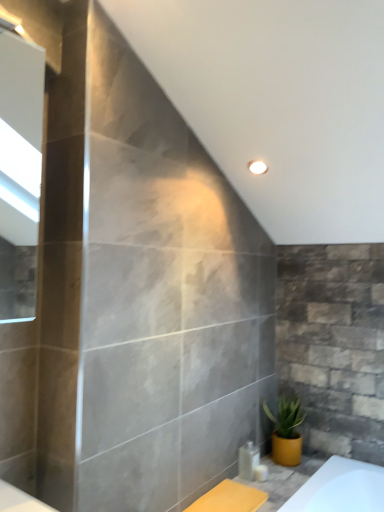
What is the approximate height of white glossy soap dispenser at lower center, which is the second toiletry in left-to-right order?

white glossy soap dispenser at lower center, which is the second toiletry in left-to-right order, is 1.95 inches in height.

Find the location of a particular element. This screenshot has width=384, height=512. white glossy soap dispenser at lower center, the 1th toiletry in the right-to-left sequence is located at coordinates (261, 473).

Is clear plastic bottle at lower right, which is counted as the second toiletry, starting from the right, far away from white glossy soap dispenser at lower center, the 1th toiletry in the right-to-left sequence?

clear plastic bottle at lower right, which is counted as the second toiletry, starting from the right, is near white glossy soap dispenser at lower center, the 1th toiletry in the right-to-left sequence, not far away.

Is white glossy soap dispenser at lower center, the 1th toiletry in the right-to-left sequence, completely or partially inside clear plastic bottle at lower right, the 1th toiletry from the left?

No.

In the scene shown: Is clear plastic bottle at lower right, the 1th toiletry from the left, behind white glossy soap dispenser at lower center, the 1th toiletry in the right-to-left sequence?

Yes, clear plastic bottle at lower right, the 1th toiletry from the left, is further from the viewer.

From a real-world perspective, which is physically below, clear plastic bottle at lower right, which is counted as the second toiletry, starting from the right, or white glossy soap dispenser at lower center, which is the second toiletry in left-to-right order?

white glossy soap dispenser at lower center, which is the second toiletry in left-to-right order, is physically lower.

Can you confirm if clear plastic bottle at lower right, the 1th toiletry from the left, is bigger than yellow matte pot at lower right?

Incorrect, clear plastic bottle at lower right, the 1th toiletry from the left, is not larger than yellow matte pot at lower right.

Based on the photo, is clear plastic bottle at lower right, the 1th toiletry from the left, not close to yellow matte pot at lower right?

That's not correct — clear plastic bottle at lower right, the 1th toiletry from the left, is a little close to yellow matte pot at lower right.

Is clear plastic bottle at lower right, the 1th toiletry from the left, aimed at yellow matte pot at lower right?

No, clear plastic bottle at lower right, the 1th toiletry from the left, is not turned towards yellow matte pot at lower right.

There is a white glossy soap dispenser at lower center, the 1th toiletry in the right-to-left sequence. Where is `houseplant above it (from a real-world perspective)`? The height and width of the screenshot is (512, 384). houseplant above it (from a real-world perspective) is located at coordinates (286, 431).

Can you confirm if yellow matte pot at lower right is bigger than white glossy soap dispenser at lower center, which is the second toiletry in left-to-right order?

Yes.

How different are the orientations of white glossy soap dispenser at lower center, which is the second toiletry in left-to-right order, and clear plastic bottle at lower right, which is counted as the second toiletry, starting from the right, in degrees?

The angle between the facing direction of white glossy soap dispenser at lower center, which is the second toiletry in left-to-right order, and the facing direction of clear plastic bottle at lower right, which is counted as the second toiletry, starting from the right, is 1.28 degrees.

In the scene shown: Which of these two, white glossy soap dispenser at lower center, the 1th toiletry in the right-to-left sequence, or clear plastic bottle at lower right, which is counted as the second toiletry, starting from the right, is thinner?

Thinner between the two is white glossy soap dispenser at lower center, the 1th toiletry in the right-to-left sequence.

Between white glossy soap dispenser at lower center, which is the second toiletry in left-to-right order, and clear plastic bottle at lower right, which is counted as the second toiletry, starting from the right, which one has smaller size?

white glossy soap dispenser at lower center, which is the second toiletry in left-to-right order.

Is white glossy soap dispenser at lower center, the 1th toiletry in the right-to-left sequence, oriented away from clear plastic bottle at lower right, the 1th toiletry from the left?

That's right, white glossy soap dispenser at lower center, the 1th toiletry in the right-to-left sequence, is facing away from clear plastic bottle at lower right, the 1th toiletry from the left.

From the image's perspective, is white glossy soap dispenser at lower center, which is the second toiletry in left-to-right order, under yellow matte pot at lower right?

Indeed, from the image's perspective, white glossy soap dispenser at lower center, which is the second toiletry in left-to-right order, is shown beneath yellow matte pot at lower right.

Is white glossy soap dispenser at lower center, the 1th toiletry in the right-to-left sequence, bigger or smaller than yellow matte pot at lower right?

Clearly, white glossy soap dispenser at lower center, the 1th toiletry in the right-to-left sequence, is smaller in size than yellow matte pot at lower right.

Is white glossy soap dispenser at lower center, the 1th toiletry in the right-to-left sequence, looking in the opposite direction of yellow matte pot at lower right?

No, white glossy soap dispenser at lower center, the 1th toiletry in the right-to-left sequence, is not facing away from yellow matte pot at lower right.

Which of these two, white glossy soap dispenser at lower center, the 1th toiletry in the right-to-left sequence, or yellow matte pot at lower right, is wider?

Answer: Wider between the two is yellow matte pot at lower right.

Which is in front, point (279, 412) or point (247, 462)?

The point (247, 462) is closer to the camera.

Where is `houseplant located above the clear plastic bottle at lower right, the 1th toiletry from the left (from a real-world perspective)`? The height and width of the screenshot is (512, 384). houseplant located above the clear plastic bottle at lower right, the 1th toiletry from the left (from a real-world perspective) is located at coordinates coord(286,431).

In terms of width, does yellow matte pot at lower right look wider or thinner when compared to clear plastic bottle at lower right, the 1th toiletry from the left?

yellow matte pot at lower right is wider than clear plastic bottle at lower right, the 1th toiletry from the left.

Does yellow matte pot at lower right have a smaller size compared to clear plastic bottle at lower right, which is counted as the second toiletry, starting from the right?

Incorrect, yellow matte pot at lower right is not smaller in size than clear plastic bottle at lower right, which is counted as the second toiletry, starting from the right.

The width and height of the screenshot is (384, 512). What are the coordinates of `toiletry that is above the white glossy soap dispenser at lower center, which is the second toiletry in left-to-right order (from a real-world perspective)` in the screenshot? It's located at (248, 460).

This screenshot has height=512, width=384. I want to click on houseplant that is on the right side of clear plastic bottle at lower right, the 1th toiletry from the left, so click(x=286, y=431).

Estimate the real-world distances between objects in this image. Which object is closer to yellow matte pot at lower right, clear plastic bottle at lower right, which is counted as the second toiletry, starting from the right, or white glossy soap dispenser at lower center, the 1th toiletry in the right-to-left sequence?

clear plastic bottle at lower right, which is counted as the second toiletry, starting from the right.

Which object lies nearer to the anchor point yellow matte pot at lower right, white glossy soap dispenser at lower center, the 1th toiletry in the right-to-left sequence, or clear plastic bottle at lower right, the 1th toiletry from the left?

Based on the image, clear plastic bottle at lower right, the 1th toiletry from the left, appears to be nearer to yellow matte pot at lower right.

Considering their positions, is white glossy soap dispenser at lower center, the 1th toiletry in the right-to-left sequence, positioned closer to clear plastic bottle at lower right, which is counted as the second toiletry, starting from the right, than yellow matte pot at lower right?

white glossy soap dispenser at lower center, the 1th toiletry in the right-to-left sequence, is positioned closer to the anchor clear plastic bottle at lower right, which is counted as the second toiletry, starting from the right.

Considering their positions, is clear plastic bottle at lower right, which is counted as the second toiletry, starting from the right, positioned further to white glossy soap dispenser at lower center, the 1th toiletry in the right-to-left sequence, than yellow matte pot at lower right?

Based on the image, yellow matte pot at lower right appears to be further to white glossy soap dispenser at lower center, the 1th toiletry in the right-to-left sequence.

Consider the image. Looking at the image, which one is located closer to white glossy soap dispenser at lower center, the 1th toiletry in the right-to-left sequence, yellow matte pot at lower right or clear plastic bottle at lower right, which is counted as the second toiletry, starting from the right?

clear plastic bottle at lower right, which is counted as the second toiletry, starting from the right, lies closer to white glossy soap dispenser at lower center, the 1th toiletry in the right-to-left sequence, than the other object.

When comparing their distances from clear plastic bottle at lower right, which is counted as the second toiletry, starting from the right, does yellow matte pot at lower right or white glossy soap dispenser at lower center, the 1th toiletry in the right-to-left sequence, seem further?

yellow matte pot at lower right lies further to clear plastic bottle at lower right, which is counted as the second toiletry, starting from the right, than the other object.

Where is `toiletry located between clear plastic bottle at lower right, which is counted as the second toiletry, starting from the right, and yellow matte pot at lower right in the left-right direction`? toiletry located between clear plastic bottle at lower right, which is counted as the second toiletry, starting from the right, and yellow matte pot at lower right in the left-right direction is located at coordinates (261, 473).